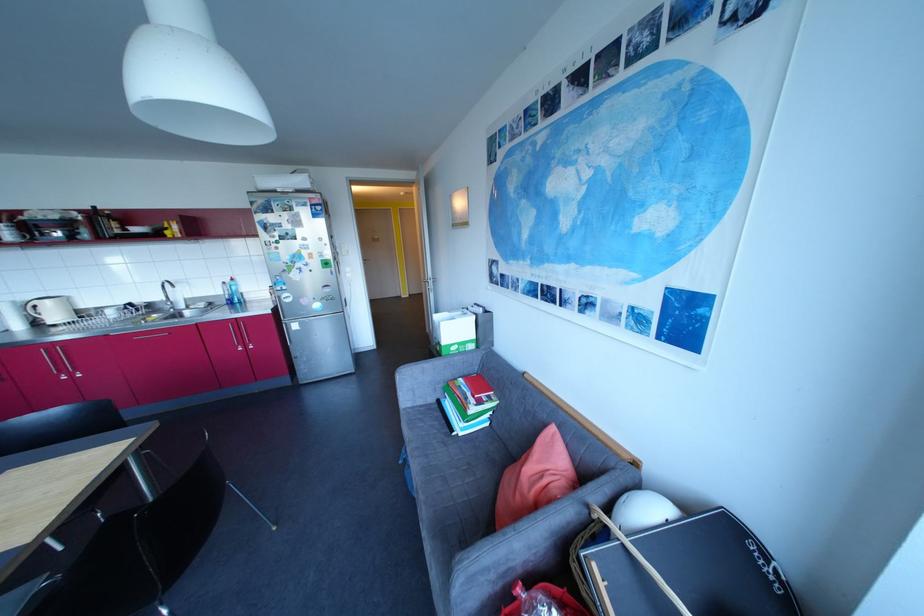
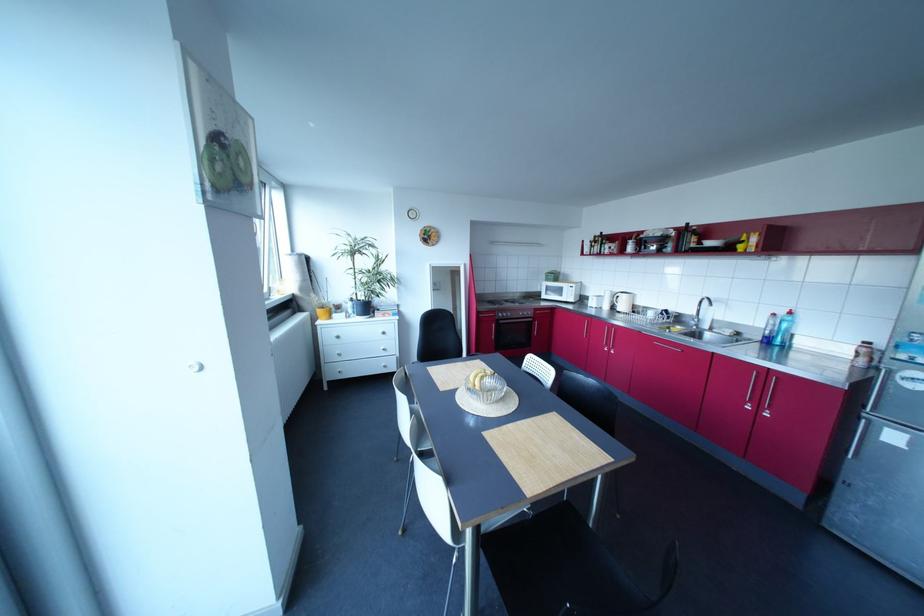
Question: The camera is either moving clockwise (left) or counter-clockwise (right) around the object. The first image is from the beginning of the video and the second image is from the end. Is the camera moving left or right when shooting the video?

Choices:
 (A) Left
 (B) Right

Answer: (B)